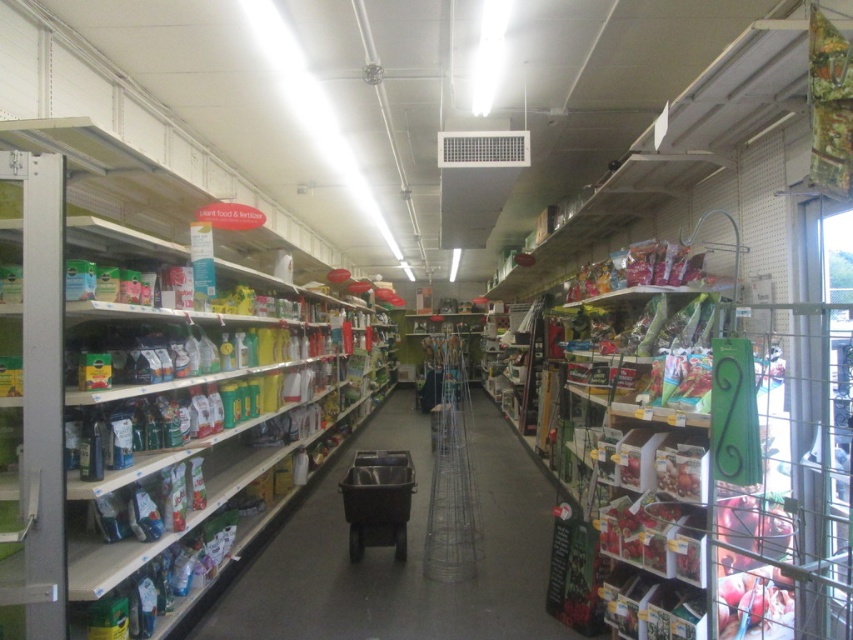
Question: Is green matte plant food at center closer to camera compared to metallic gray shopping cart at center?

Choices:
 (A) yes
 (B) no

Answer: (A)

Question: Which object is positioned closest to the green matte plant food at center?

Choices:
 (A) metallic silver shelves at left
 (B) metallic gray shopping cart at center

Answer: (B)

Question: Which is farther from the metallic silver shelves at left?

Choices:
 (A) metallic gray shopping cart at center
 (B) green matte plant food at center

Answer: (B)

Question: Which point is closer to the camera?

Choices:
 (A) green matte plant food at center
 (B) metallic silver shelves at left

Answer: (B)

Question: Can you confirm if metallic silver shelves at left is smaller than green matte plant food at center?

Choices:
 (A) no
 (B) yes

Answer: (A)

Question: Is metallic silver shelves at left thinner than green matte plant food at center?

Choices:
 (A) no
 (B) yes

Answer: (B)